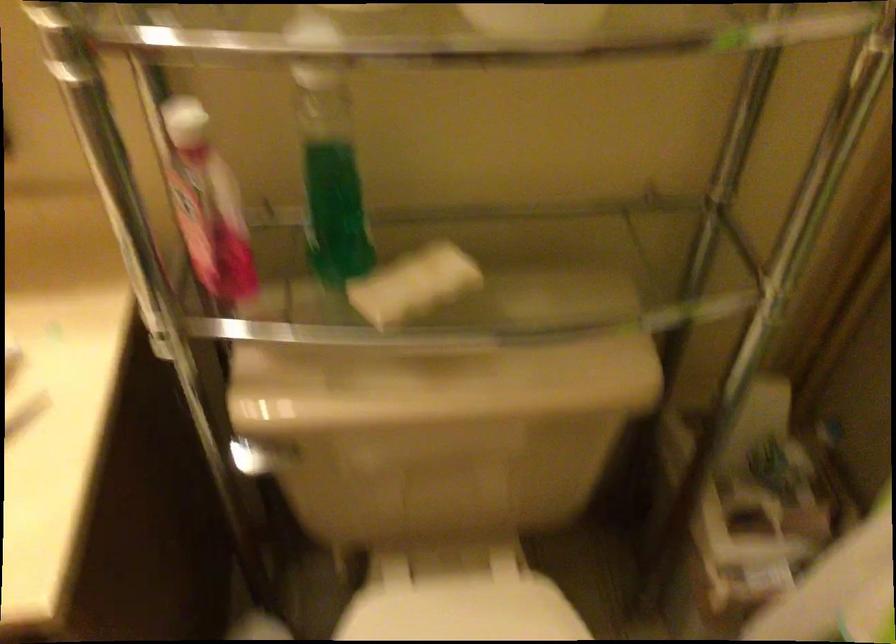
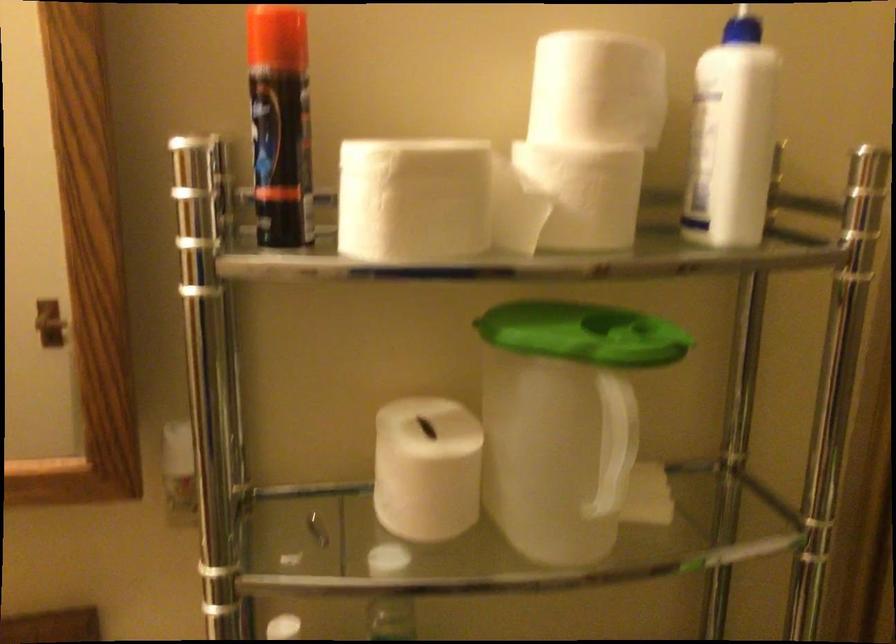
Question: How did the camera likely rotate?

Choices:
 (A) Left
 (B) Right
 (C) Up
 (D) Down

Answer: (C)